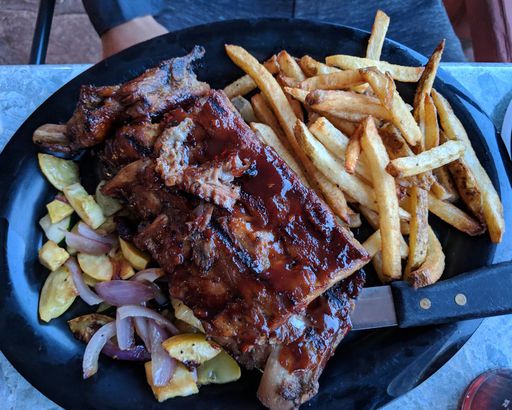
I want to click on plate, so click(x=390, y=362).